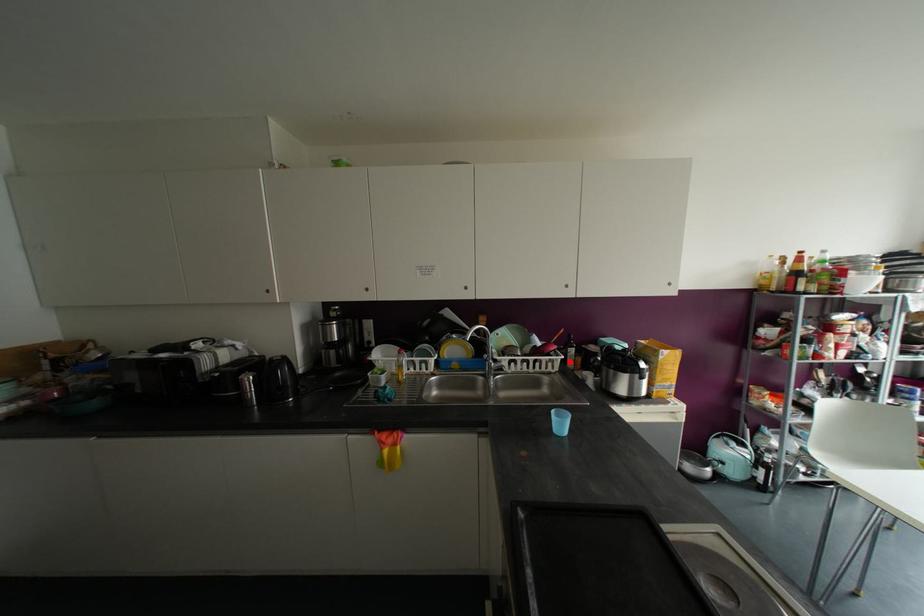
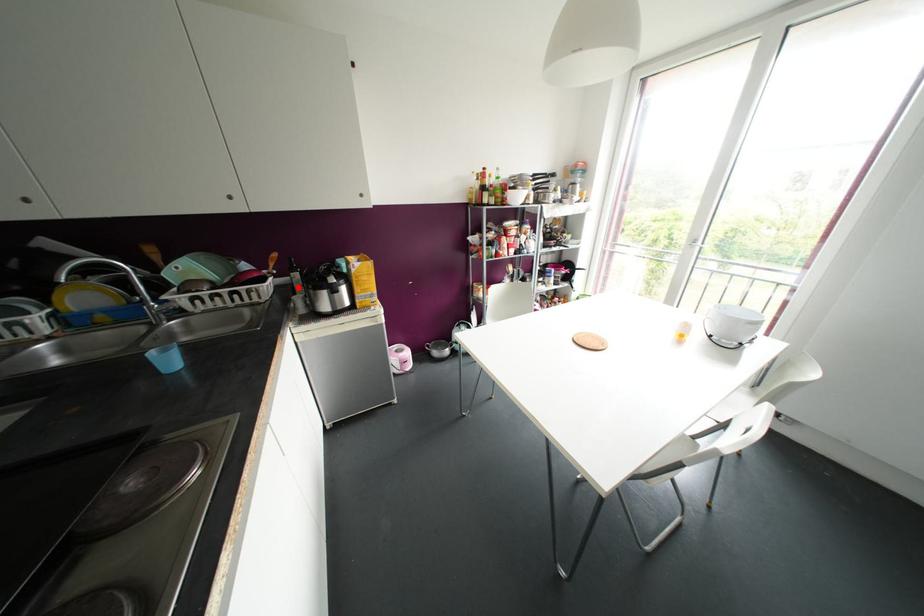
I am providing you with two images of the same scene from different viewpoints. A red point is marked on the first image and another point is marked on the second image. Is the marked point in image1 the same physical position as the marked point in image2?

Yes